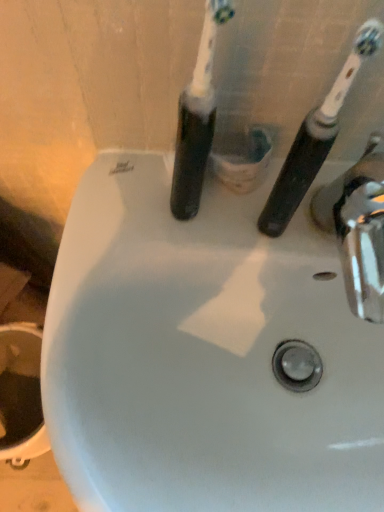
Where is `vacant space positioned to the left of black plastic toothbrush at center, placed as the first toothbrush when sorted from left to right`? vacant space positioned to the left of black plastic toothbrush at center, placed as the first toothbrush when sorted from left to right is located at coordinates (108, 204).